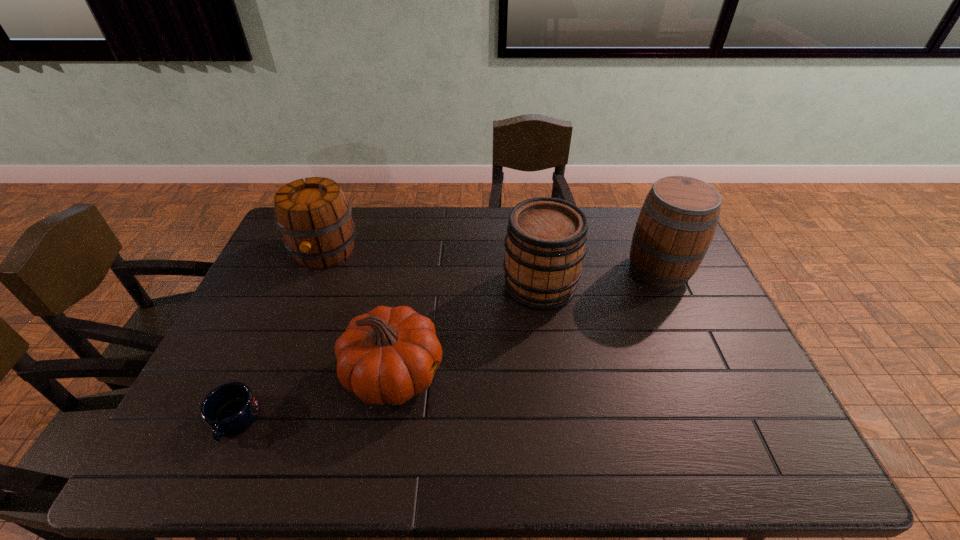
At what (x,y) coordinates should I click in order to perform the action: click on object that is at the near edge. Please return your answer as a coordinate pair (x, y). Looking at the image, I should click on (229, 409).

You are a GUI agent. You are given a task and a screenshot of the screen. Output one action in this format:
    pyautogui.click(x=<x>, y=<y>)
    Task: Click on the cider that is at the left edge
    The width and height of the screenshot is (960, 540).
    Given the screenshot: What is the action you would take?
    pyautogui.click(x=314, y=217)

At what (x,y) coordinates should I click in order to perform the action: click on mug present at the left edge. Please return your answer as a coordinate pair (x, y). The height and width of the screenshot is (540, 960). Looking at the image, I should click on click(x=229, y=409).

At what (x,y) coordinates should I click in order to perform the action: click on object located at the right edge. Please return your answer as a coordinate pair (x, y). Looking at the image, I should click on (677, 222).

Locate an element on the screen. Image resolution: width=960 pixels, height=540 pixels. object that is at the far left corner is located at coordinates (314, 217).

Locate an element on the screen. The width and height of the screenshot is (960, 540). object positioned at the near left corner is located at coordinates (229, 409).

In the image, there is a desktop. Where is `vacant space at the far edge`? This screenshot has height=540, width=960. vacant space at the far edge is located at coordinates (503, 230).

In the image, there is a desktop. Where is `vacant area at the near edge`? The width and height of the screenshot is (960, 540). vacant area at the near edge is located at coordinates (278, 455).

Locate an element on the screen. Image resolution: width=960 pixels, height=540 pixels. vacant space at the left edge of the desktop is located at coordinates (240, 362).

Where is `free region at the right edge`? This screenshot has height=540, width=960. free region at the right edge is located at coordinates (716, 349).